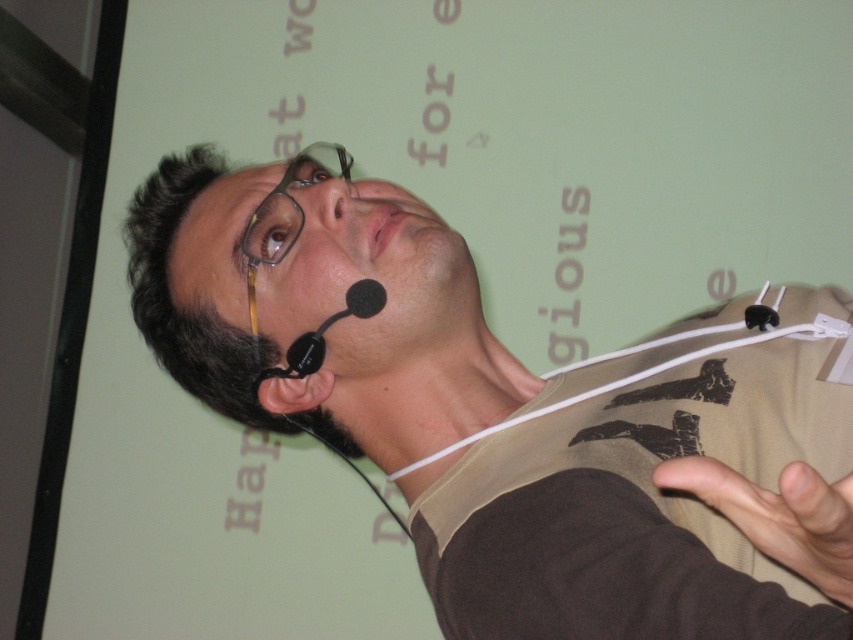
Question: Can you confirm if matte black shirt at center is wider than brown fabric hand at lower right?

Choices:
 (A) yes
 (B) no

Answer: (A)

Question: Which of these objects is positioned farthest from the brown fabric hand at lower right?

Choices:
 (A) brown plastic glasses at upper center
 (B) matte black shirt at center

Answer: (A)

Question: Considering the relative positions of matte black shirt at center and brown fabric hand at lower right in the image provided, where is matte black shirt at center located with respect to brown fabric hand at lower right?

Choices:
 (A) above
 (B) below

Answer: (A)

Question: Among these points, which one is farthest from the camera?

Choices:
 (A) (782, 502)
 (B) (155, 337)

Answer: (B)

Question: In this image, where is matte black shirt at center located relative to brown fabric hand at lower right?

Choices:
 (A) left
 (B) right

Answer: (A)

Question: Which object appears farthest from the camera in this image?

Choices:
 (A) matte black shirt at center
 (B) brown plastic glasses at upper center

Answer: (B)